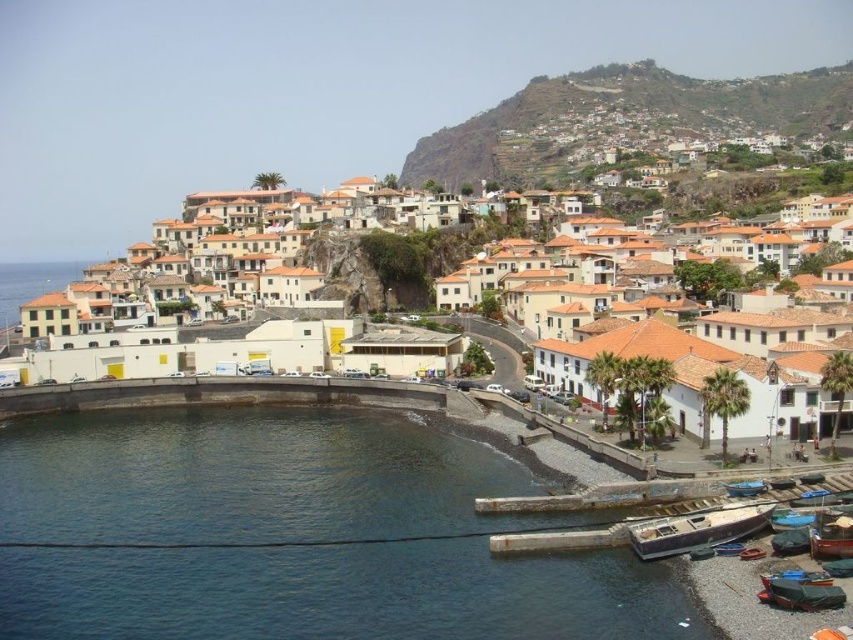
Question: Which object is the farthest from the green grassy hillside at upper center?

Choices:
 (A) green matte boat at lower right
 (B) blue wooden boat at lower right
 (C) dark blue water at lower left

Answer: (A)

Question: Based on their relative distances, which object is farther from the dark blue water at lower left?

Choices:
 (A) green grassy hillside at upper center
 (B) white matte building at center
 (C) blue plastic boat at lower right

Answer: (A)

Question: Does green grassy hillside at upper center lie behind green matte boat at lower right?

Choices:
 (A) no
 (B) yes

Answer: (B)

Question: Which point is farther from the camera taking this photo?

Choices:
 (A) (741, 484)
 (B) (798, 515)
 (C) (256, 632)
 (D) (834, 518)

Answer: (A)

Question: Does green grassy hillside at upper center have a smaller size compared to blue wooden boat at lower right?

Choices:
 (A) no
 (B) yes

Answer: (A)

Question: Can you confirm if white fiberglass boat at lower right is positioned to the left of metallic silver boat at lower right?

Choices:
 (A) yes
 (B) no

Answer: (A)